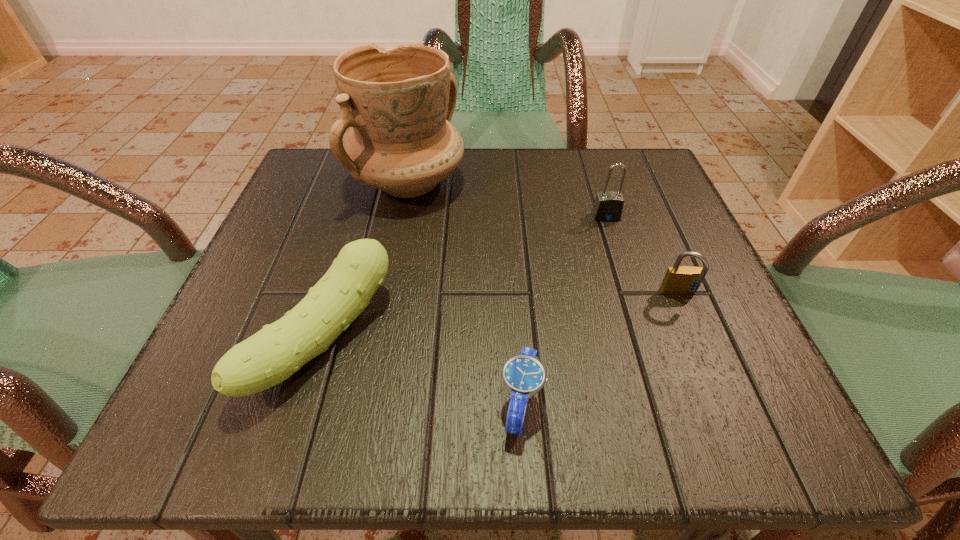
The height and width of the screenshot is (540, 960). In order to click on pottery in this screenshot , I will do `click(399, 102)`.

The height and width of the screenshot is (540, 960). What are the coordinates of `the fourth object from left to right` in the screenshot? It's located at (608, 206).

The width and height of the screenshot is (960, 540). What are the coordinates of `the left padlock` in the screenshot? It's located at (608, 206).

The height and width of the screenshot is (540, 960). In order to click on cucumber in this screenshot , I will do `click(270, 356)`.

This screenshot has height=540, width=960. What are the coordinates of `the shorter padlock` in the screenshot? It's located at (683, 280).

Where is `the nearer padlock`? This screenshot has height=540, width=960. the nearer padlock is located at coordinates point(683,280).

This screenshot has height=540, width=960. What are the coordinates of `the third object from right to left` in the screenshot? It's located at (523, 375).

Locate an element on the screen. watch is located at coordinates (523, 375).

Locate an element on the screen. free space located 0.200m on the right of the tallest object is located at coordinates (563, 181).

Find the location of a particular element. free location located 0.200m on the shackle of the left padlock is located at coordinates (634, 305).